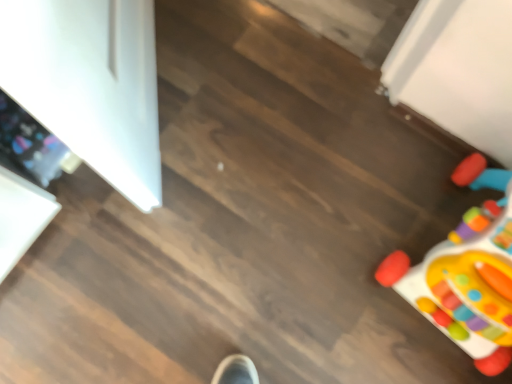
In order to click on vacant area situated to the left side of plastic colorful toy at lower right in this screenshot , I will do `click(331, 251)`.